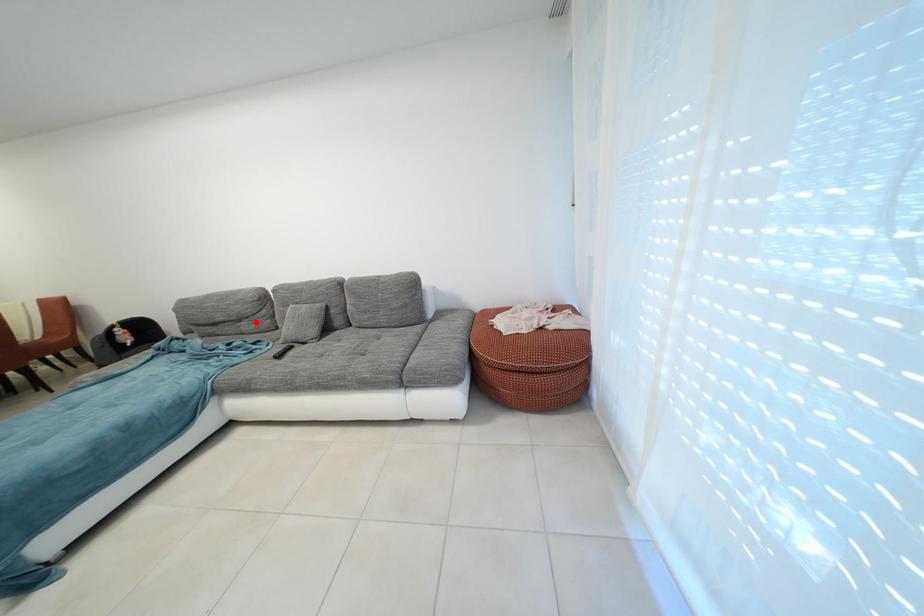
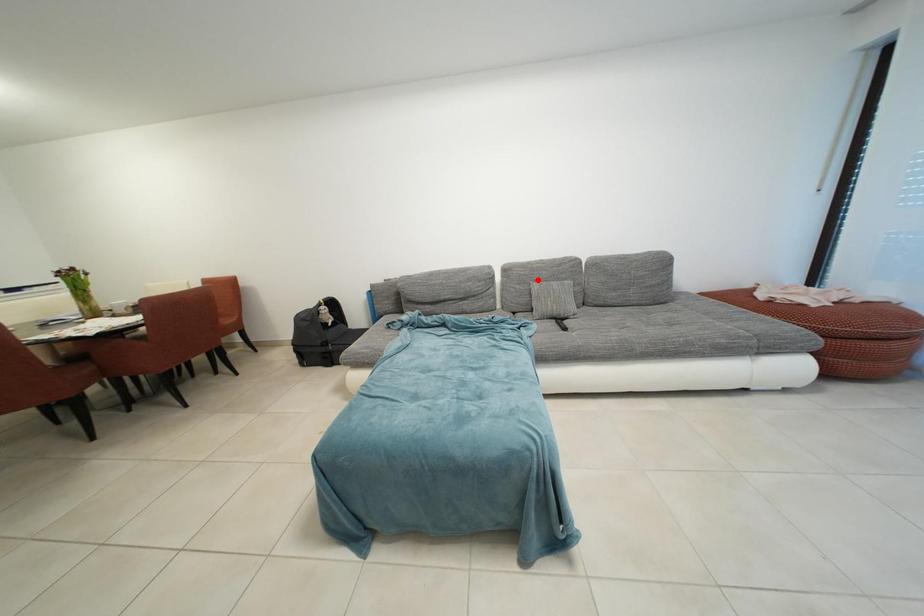
I am providing you with two images of the same scene from different viewpoints. A red point is marked on the first image and another point is marked on the second image. Is the marked point in image1 the same physical position as the marked point in image2?

No